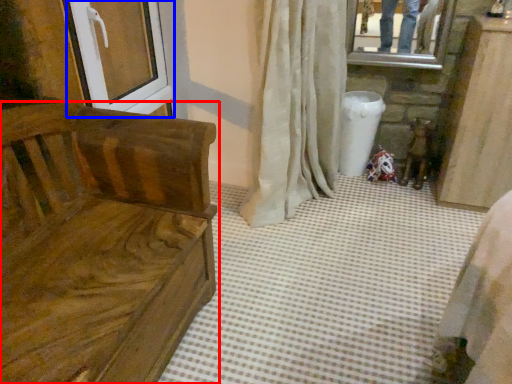
Question: Which of the following is the closest to the observer, furniture (highlighted by a red box) or screen door (highlighted by a blue box)?

Choices:
 (A) furniture
 (B) screen door

Answer: (A)